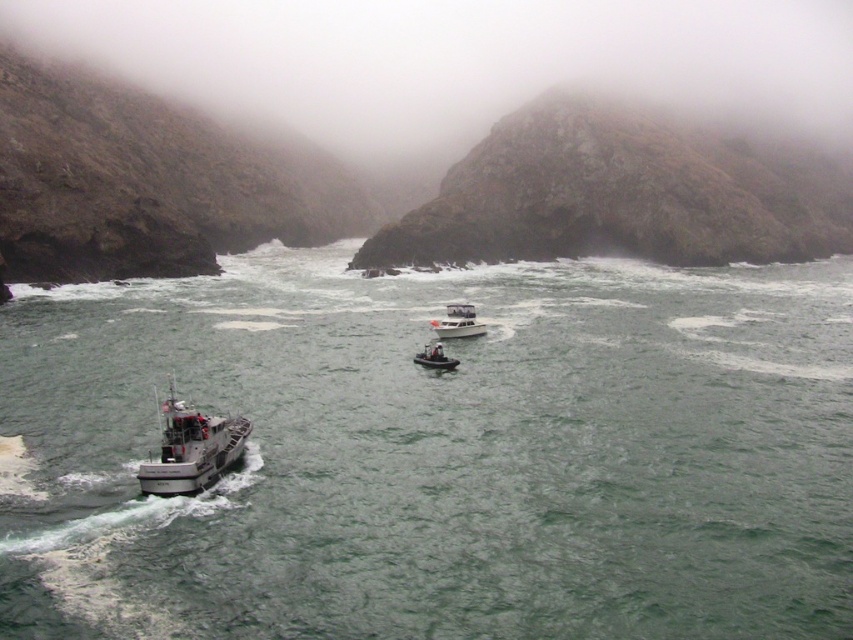
Between metallic gray boat at lower left and white plastic dinghy at center, which one has less height?

white plastic dinghy at center is shorter.

Between point (187, 428) and point (444, 356), which one is positioned behind?

Point (444, 356)

In order to click on metallic gray boat at lower left in this screenshot , I will do `click(190, 449)`.

Which is more to the right, green matte water at center or white plastic dinghy at center?

green matte water at center

Between green matte water at center and white plastic dinghy at center, which one has less height?

white plastic dinghy at center

You are a GUI agent. You are given a task and a screenshot of the screen. Output one action in this format:
    pyautogui.click(x=<x>, y=<y>)
    Task: Click on the green matte water at center
    
    Given the screenshot: What is the action you would take?
    pyautogui.click(x=439, y=452)

Is green matte water at center thinner than metallic gray boat at lower left?

No.

What do you see at coordinates (439, 452) in the screenshot?
I see `green matte water at center` at bounding box center [439, 452].

Identify the location of green matte water at center. (439, 452).